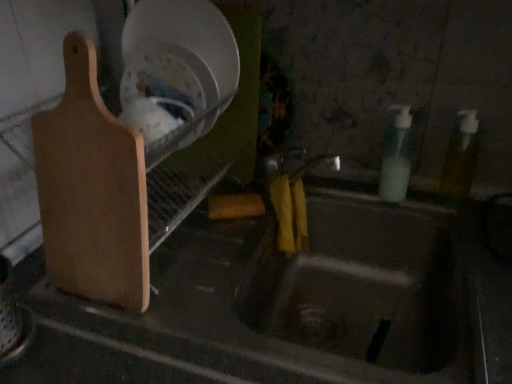
Question: From their relative heights in the image, would you say translucent plastic soap dispenser at right, which ranks as the second bottle in right-to-left order, is taller or shorter than translucent yellow bottle at right, the 2th bottle when ordered from left to right?

Choices:
 (A) tall
 (B) short

Answer: (A)

Question: Looking at their shapes, would you say translucent plastic soap dispenser at right, which is the first bottle in left-to-right order, is wider or thinner than translucent yellow bottle at right, the 2th bottle when ordered from left to right?

Choices:
 (A) thin
 (B) wide

Answer: (B)

Question: Considering the real-world distances, which object is farthest from the light brown wood cutting board at left?

Choices:
 (A) metallic sink at center
 (B) translucent yellow bottle at right, the first bottle when ordered from right to left
 (C) translucent plastic soap dispenser at right, which ranks as the second bottle in right-to-left order

Answer: (B)

Question: Which of these objects is positioned farthest from the metallic sink at center?

Choices:
 (A) translucent plastic soap dispenser at right, which is the first bottle in left-to-right order
 (B) translucent yellow bottle at right, the first bottle when ordered from right to left
 (C) light brown wood cutting board at left

Answer: (C)